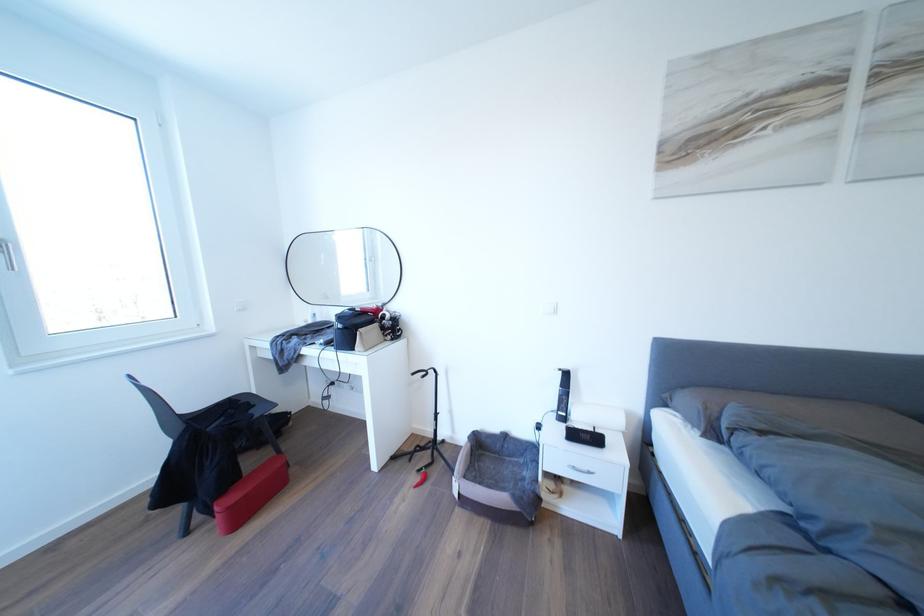
Find where to lift the red rectangular case. Please return your answer as a coordinate pair (x, y).

(250, 493)